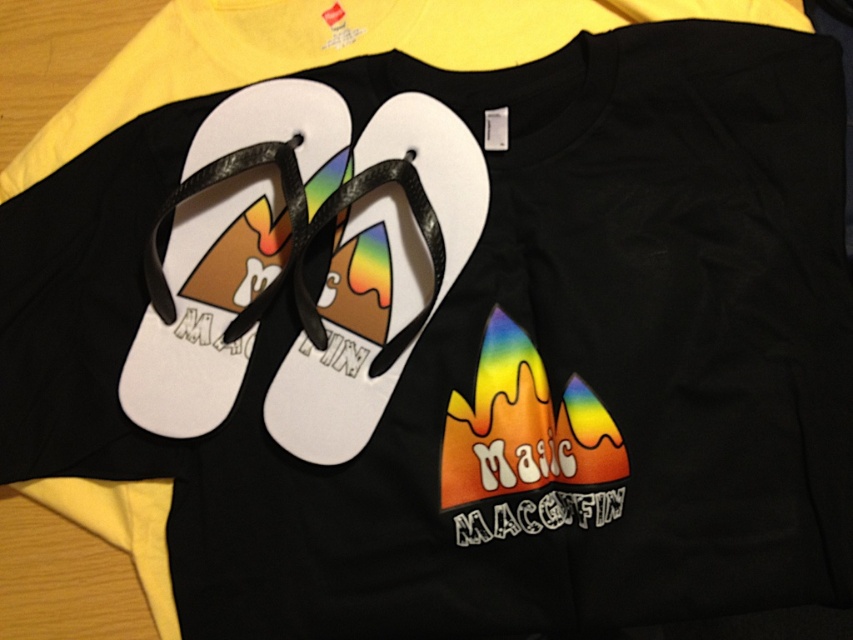
Question: Which point is farther to the camera?

Choices:
 (A) white rubber sandal at center
 (B) white matte sandal at center

Answer: (A)

Question: Considering the relative positions of white matte sandal at center and white rubber sandal at center in the image provided, where is white matte sandal at center located with respect to white rubber sandal at center?

Choices:
 (A) above
 (B) below

Answer: (A)

Question: Which point is farther to the camera?

Choices:
 (A) white rubber sandal at center
 (B) white matte sandal at center

Answer: (A)

Question: Which point is farther to the camera?

Choices:
 (A) white rubber sandal at center
 (B) white matte sandal at center

Answer: (A)

Question: Is white matte sandal at center below white rubber sandal at center?

Choices:
 (A) no
 (B) yes

Answer: (A)

Question: From the image, what is the correct spatial relationship of white matte sandal at center in relation to white rubber sandal at center?

Choices:
 (A) left
 (B) right

Answer: (A)